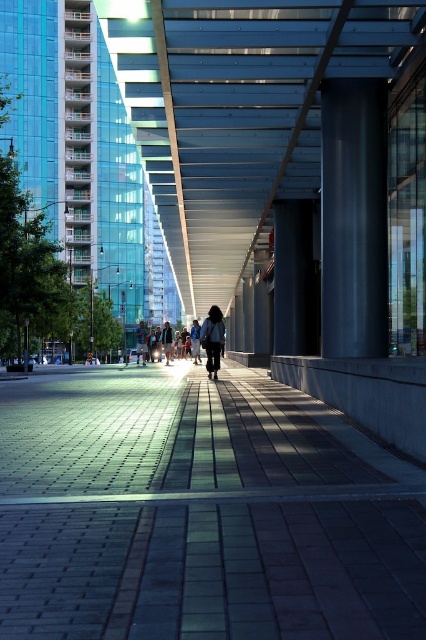
Does black glossy pillar at center have a greater height compared to dark blue jeans at center?

Indeed, black glossy pillar at center has a greater height compared to dark blue jeans at center.

Between black glossy pillar at center and dark blue jeans at center, which one appears on the left side from the viewer's perspective?

Positioned to the left is dark blue jeans at center.

Image resolution: width=426 pixels, height=640 pixels. Find the location of `black glossy pillar at center`. black glossy pillar at center is located at coordinates (293, 278).

Where is `black glossy pillar at center`? The height and width of the screenshot is (640, 426). black glossy pillar at center is located at coordinates (293, 278).

Is point (187, 422) closer to camera compared to point (195, 360)?

That is True.

This screenshot has height=640, width=426. Describe the element at coordinates (199, 512) in the screenshot. I see `brick paved sidewalk at center` at that location.

Identify the location of brick paved sidewalk at center. The width and height of the screenshot is (426, 640). (199, 512).

Does black smooth pillar at center have a smaller size compared to dark gray jacket at center?

Yes, black smooth pillar at center is smaller than dark gray jacket at center.

Is black smooth pillar at center thinner than dark gray jacket at center?

In fact, black smooth pillar at center might be wider than dark gray jacket at center.

Is point (374, 180) farther from camera compared to point (192, 326)?

No.

Locate an element on the screen. black smooth pillar at center is located at coordinates (354, 218).